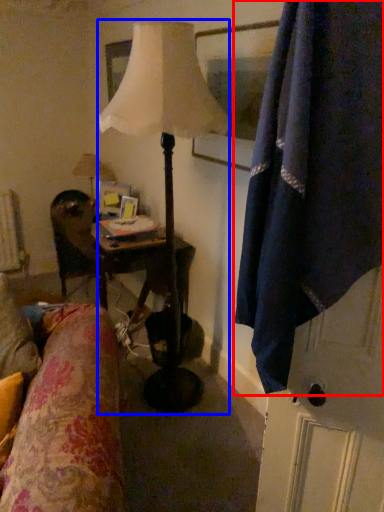
Question: Which object appears closest to the camera in this image, curtain (highlighted by a red box) or lamp (highlighted by a blue box)?

Choices:
 (A) curtain
 (B) lamp

Answer: (A)